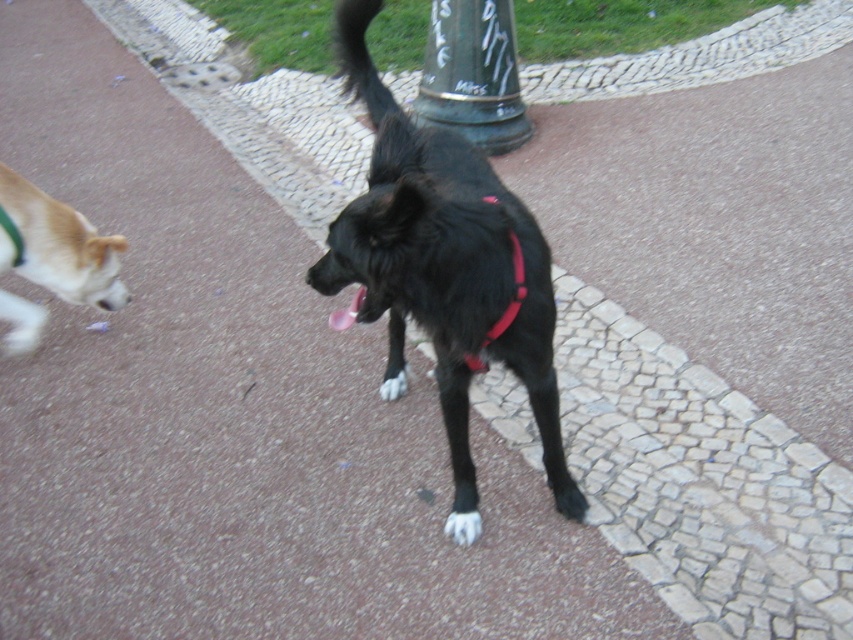
Is point (366, 56) positioned behind point (335, 310)?

That is False.

Can you confirm if black fur tail at upper center is shorter than pink fabric at center?

Incorrect, black fur tail at upper center's height does not fall short of pink fabric at center's.

Image resolution: width=853 pixels, height=640 pixels. Identify the location of black fur tail at upper center. (360, 58).

Is the position of black fur dog at center less distant than that of red fabric neckband at center?

Yes, black fur dog at center is in front of red fabric neckband at center.

Which is in front, point (409, 289) or point (486, 333)?

Point (409, 289) is in front.

You are a GUI agent. You are given a task and a screenshot of the screen. Output one action in this format:
    pyautogui.click(x=<x>, y=<y>)
    Task: Click on the black fur dog at center
    The image size is (853, 640).
    Given the screenshot: What is the action you would take?
    pyautogui.click(x=445, y=269)

Measure the distance from black fur dog at center to black fur tail at upper center.

black fur dog at center and black fur tail at upper center are 38.46 centimeters apart from each other.

Who is positioned more to the left, black fur dog at center or black fur tail at upper center?

Positioned to the left is black fur tail at upper center.

Between point (518, 275) and point (373, 83), which one is positioned in front?

Point (518, 275) is in front.

Where is `black fur dog at center`? The height and width of the screenshot is (640, 853). black fur dog at center is located at coordinates (445, 269).